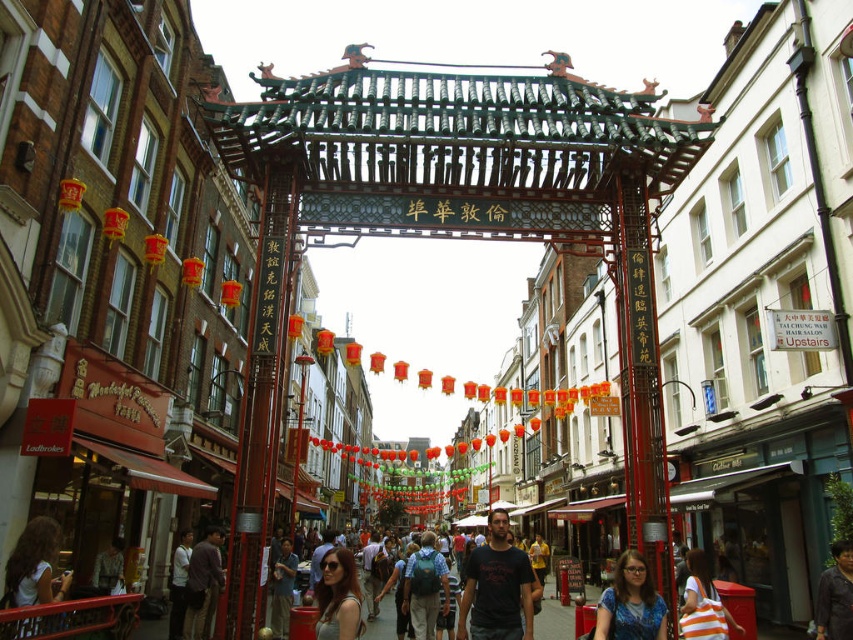
You are a tourist walking down the street in London Chinatown and notice a blue printed shirt at center and an orange striped bag at center. Which item is positioned higher relative to the other?

The blue printed shirt at center is located above the orange striped bag at center, so it is positioned higher.

You are a photographer standing in the middle of the street. You notice a matte white shirt at lower left and a blue printed shirt at center. Which shirt is closer to the ground?

The matte white shirt at lower left is positioned under the blue printed shirt at center, so it is closer to the ground.